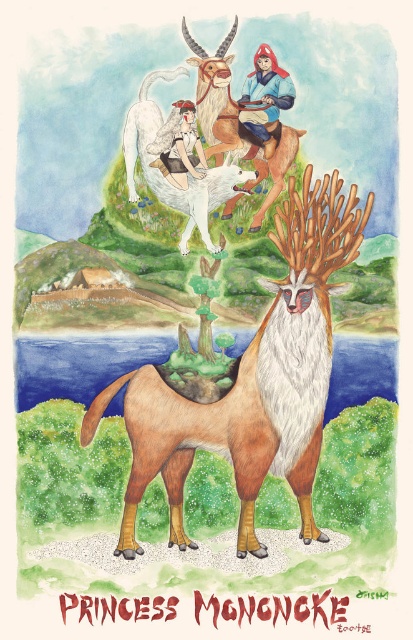
The width and height of the screenshot is (413, 640). What do you see at coordinates (251, 380) in the screenshot? I see `brown velvet deer at center` at bounding box center [251, 380].

Who is lower down, brown velvet deer at center or matte white santa claus at upper center?

brown velvet deer at center

Identify the location of brown velvet deer at center. (251, 380).

Is white fur antelope at upper center to the left of matte white santa claus at upper center from the viewer's perspective?

No, white fur antelope at upper center is not to the left of matte white santa claus at upper center.

Is white fur antelope at upper center smaller than matte white santa claus at upper center?

No, white fur antelope at upper center is not smaller than matte white santa claus at upper center.

Who is more forward, (144,115) or (170,120)?

Positioned in front is point (170,120).

The image size is (413, 640). What are the coordinates of `white fur antelope at upper center` in the screenshot? It's located at (178, 161).

Who is taller, brown velvet deer at center or matte blue santa claus at upper center?

With more height is brown velvet deer at center.

In the scene shown: Who is more distant from viewer, (178, 442) or (256, 67)?

The point (256, 67) is more distant.

Is point (368, 193) positioned in front of point (287, 93)?

Yes, point (368, 193) is in front of point (287, 93).

This screenshot has width=413, height=640. In order to click on brown velvet deer at center in this screenshot , I will do `click(251, 380)`.